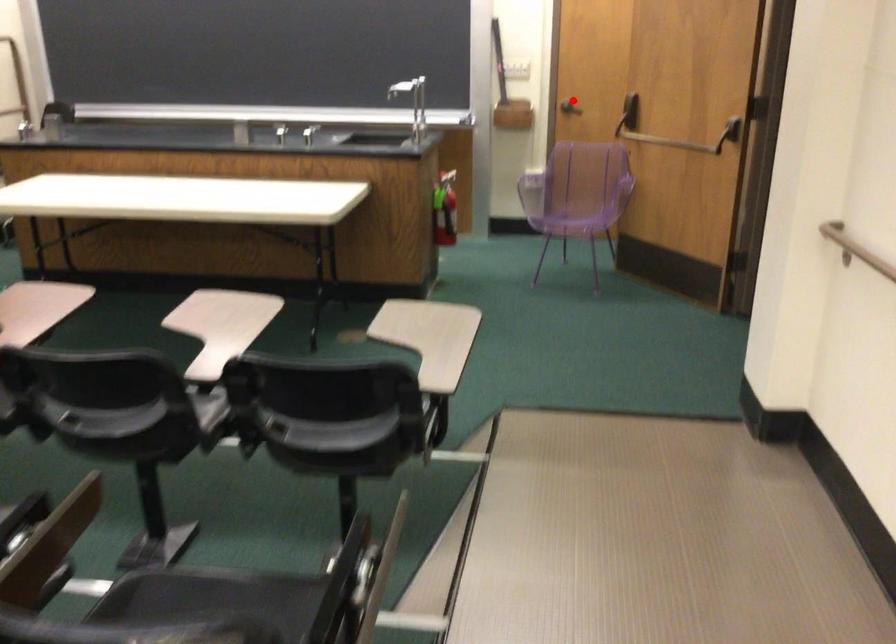
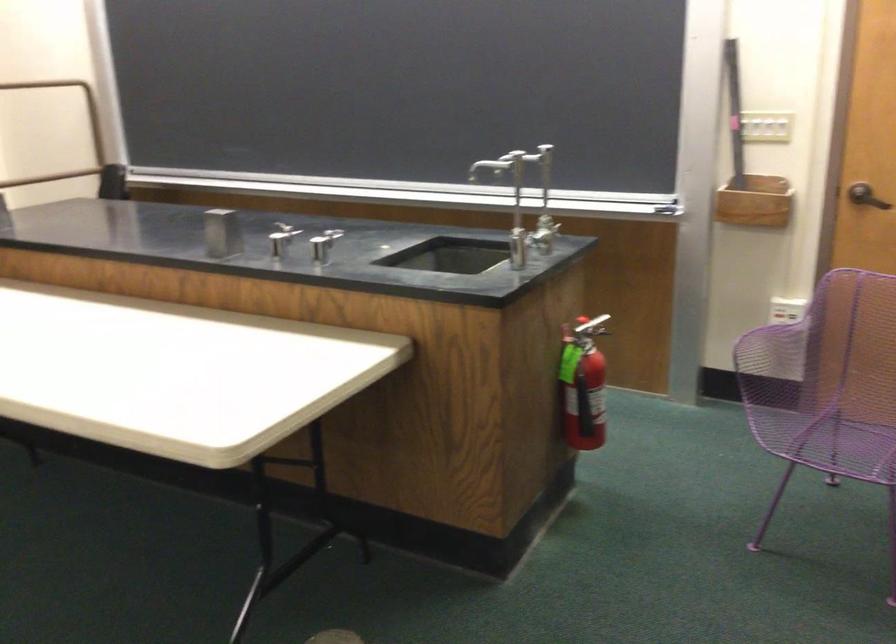
Locate, in the second image, the point that corresponds to the highlighted location in the first image.

(866, 196)